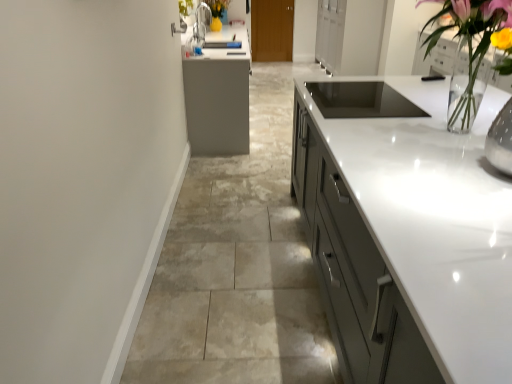
Question: Is clear glass vase at upper right bigger or smaller than brown wood door at center, which is the 2th cabinetry in bottom-to-top order?

Choices:
 (A) small
 (B) big

Answer: (B)

Question: Which is correct: clear glass vase at upper right is inside brown wood door at center, which appears as the 2th cabinetry when viewed from the front, or outside of it?

Choices:
 (A) inside
 (B) outside

Answer: (B)

Question: Estimate the real-world distances between objects in this image. Which object is closer to the matte gray cabinetry at center, which appears as the 2th cabinetry when viewed from the top?

Choices:
 (A) clear glass vase at upper right
 (B) brown wood door at center, positioned as the first cabinetry in top-to-bottom order

Answer: (A)

Question: Estimate the real-world distances between objects in this image. Which object is closer to the clear glass vase at upper right?

Choices:
 (A) brown wood door at center, which appears as the 2th cabinetry when viewed from the front
 (B) matte gray cabinetry at center, which appears as the 2th cabinetry when viewed from the top

Answer: (B)